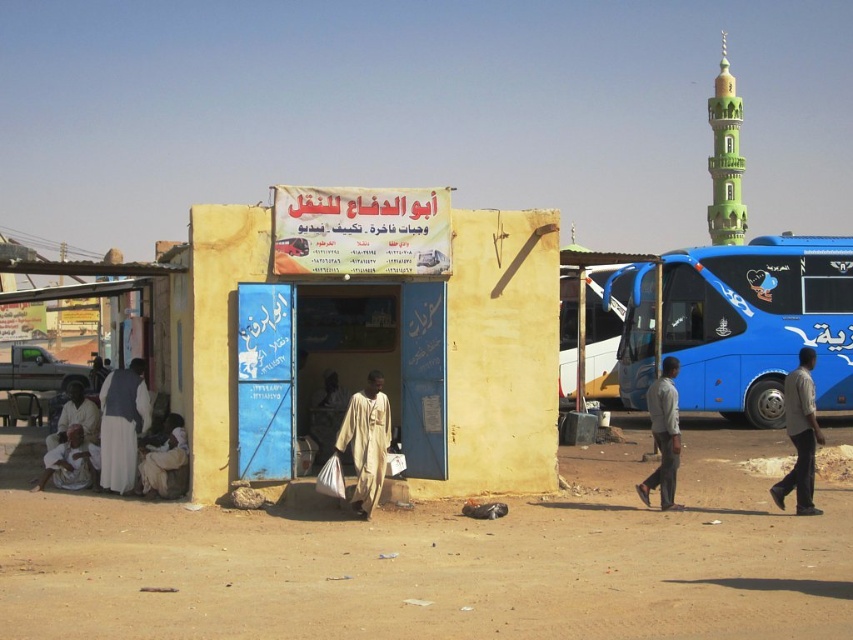
Who is more forward, (527, 385) or (361, 451)?

Point (361, 451) is in front.

Between point (352, 193) and point (358, 392), which one is positioned behind?

The point (358, 392) is behind.

Locate an element on the screen. The height and width of the screenshot is (640, 853). yellow painted wall at center is located at coordinates (375, 339).

Does blue metallic bus at right appear over white cotton clothing at lower left?

Correct, blue metallic bus at right is located above white cotton clothing at lower left.

Who is more forward, (624, 396) or (86, 452)?

Point (86, 452) is more forward.

Who is more forward, (808, 307) or (44, 486)?

Point (44, 486)

The height and width of the screenshot is (640, 853). What are the coordinates of `blue metallic bus at right` in the screenshot? It's located at (758, 323).

This screenshot has height=640, width=853. In order to click on yellow painted wall at center in this screenshot , I will do `click(375, 339)`.

Between yellow painted wall at center and white cloth at lower left, which one is positioned higher?

yellow painted wall at center is above.

Is point (215, 362) farther from camera compared to point (125, 464)?

No.

Locate an element on the screen. yellow painted wall at center is located at coordinates (375, 339).